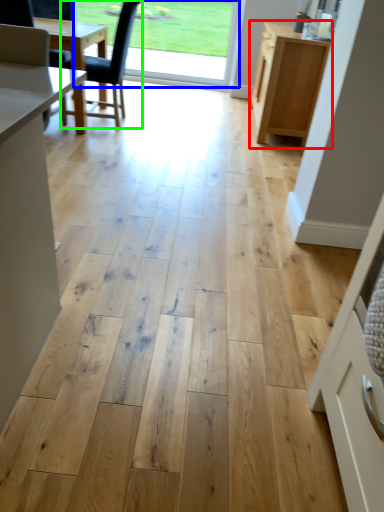
Question: Based on their relative distances, which object is farther from cabinetry (highlighted by a red box)? Choose from window screen (highlighted by a blue box) and chair (highlighted by a green box).

Choices:
 (A) window screen
 (B) chair

Answer: (A)